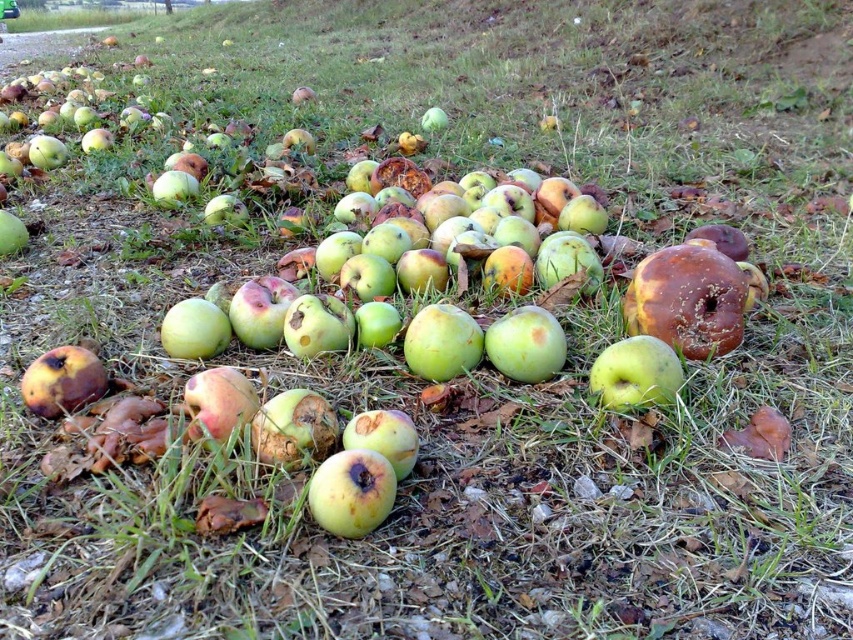
Can you confirm if greenish-yellow matte apple at center is positioned above green matte apple at center?

Actually, greenish-yellow matte apple at center is below green matte apple at center.

Which of these two, greenish-yellow matte apple at center or green matte apple at center, stands shorter?

greenish-yellow matte apple at center

Where is `greenish-yellow matte apple at center`? This screenshot has width=853, height=640. greenish-yellow matte apple at center is located at coordinates (351, 492).

Identify the location of greenish-yellow matte apple at center. (351, 492).

Does greenish-yellow matte apple at center come in front of rotten green apple at lower left?

Yes, it is in front of rotten green apple at lower left.

At what (x,y) coordinates should I click in order to perform the action: click on greenish-yellow matte apple at center. Please return your answer as a coordinate pair (x, y). Looking at the image, I should click on (351, 492).

Which of these two, green matte apple at center or rotten green apple at lower left, stands shorter?

green matte apple at center

Between point (634, 380) and point (38, 387), which one is positioned behind?

The point (634, 380) is more distant.

You are a GUI agent. You are given a task and a screenshot of the screen. Output one action in this format:
    pyautogui.click(x=<x>, y=<y>)
    Task: Click on the green matte apple at center
    The width and height of the screenshot is (853, 640).
    Given the screenshot: What is the action you would take?
    (x=636, y=372)